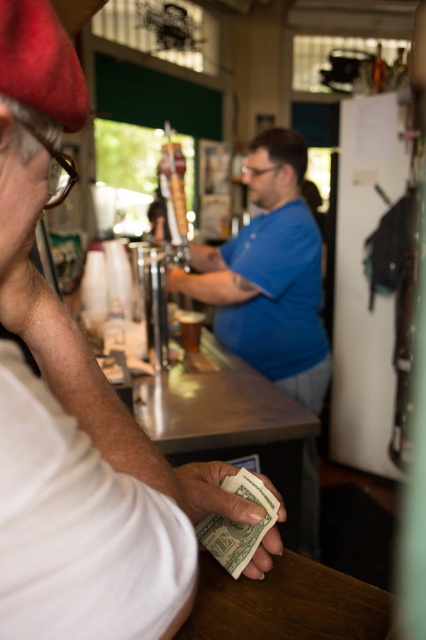
You are a customer at the bar and want to hand the white paper money at lower center to the bartender. Which direction should you move to ensure the blue cotton shirt at center can receive it?

The blue cotton shirt at center is to the right of the white paper money at lower center, so you should move the white paper money at lower center to the right to hand it to the bartender in the blue cotton shirt at center.

You are a customer trying to pay at the bar. You see the blue cotton shirt at center and the white paper money at lower center. Which object is wider from your perspective?

The blue cotton shirt at center is wider than the white paper money at lower center according to the description.